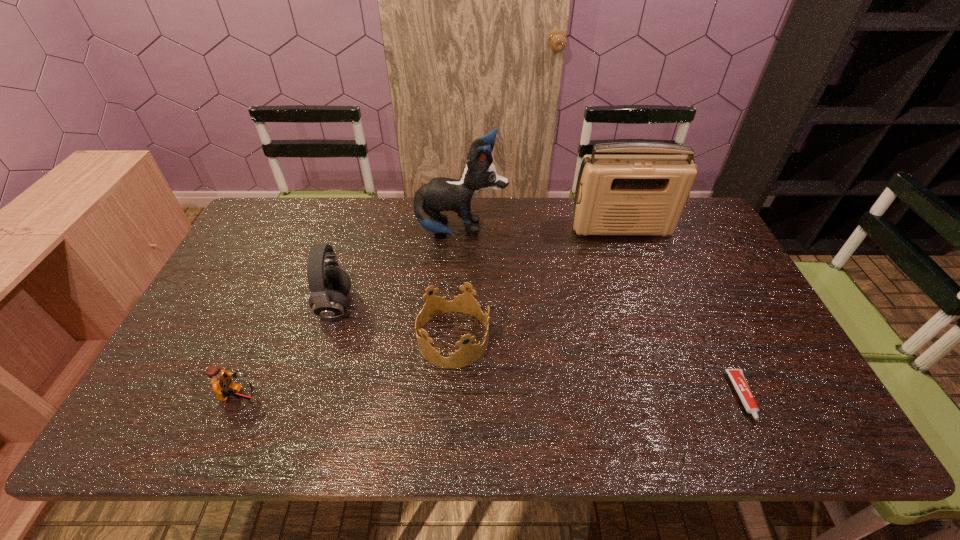
Image resolution: width=960 pixels, height=540 pixels. Identify the location of object located in the far right corner section of the desktop. (615, 194).

This screenshot has width=960, height=540. In order to click on object that is at the near right corner in this screenshot , I will do `click(737, 377)`.

At what (x,y) coordinates should I click in order to perform the action: click on vacant region at the far edge of the desktop. Please return your answer as a coordinate pair (x, y). The image size is (960, 540). Looking at the image, I should click on (564, 214).

Locate an element on the screen. free spot at the near edge of the desktop is located at coordinates (670, 419).

Identify the location of free space at the left edge of the desktop. The height and width of the screenshot is (540, 960). (261, 266).

I want to click on vacant space at the right edge of the desktop, so click(x=762, y=371).

The height and width of the screenshot is (540, 960). What are the coordinates of `free spot at the far left corner of the desktop` in the screenshot? It's located at (281, 215).

Image resolution: width=960 pixels, height=540 pixels. Find the location of `free point at the near left corner`. free point at the near left corner is located at coordinates click(x=149, y=444).

In the image, there is a desktop. Where is `vacant space at the near right corner`? The width and height of the screenshot is (960, 540). vacant space at the near right corner is located at coordinates (830, 432).

Find the location of `free spot between the tiara and the puppy`. free spot between the tiara and the puppy is located at coordinates (457, 285).